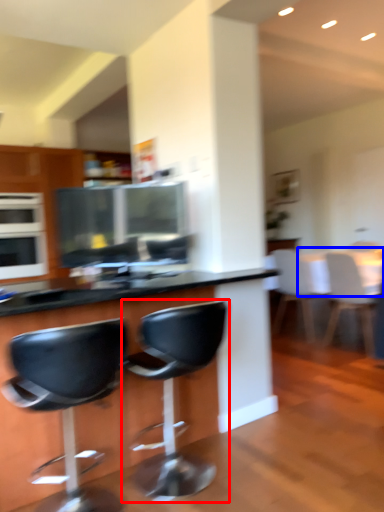
Question: Which point is closer to the camera, chair (highlighted by a red box) or table (highlighted by a blue box)?

Choices:
 (A) chair
 (B) table

Answer: (A)